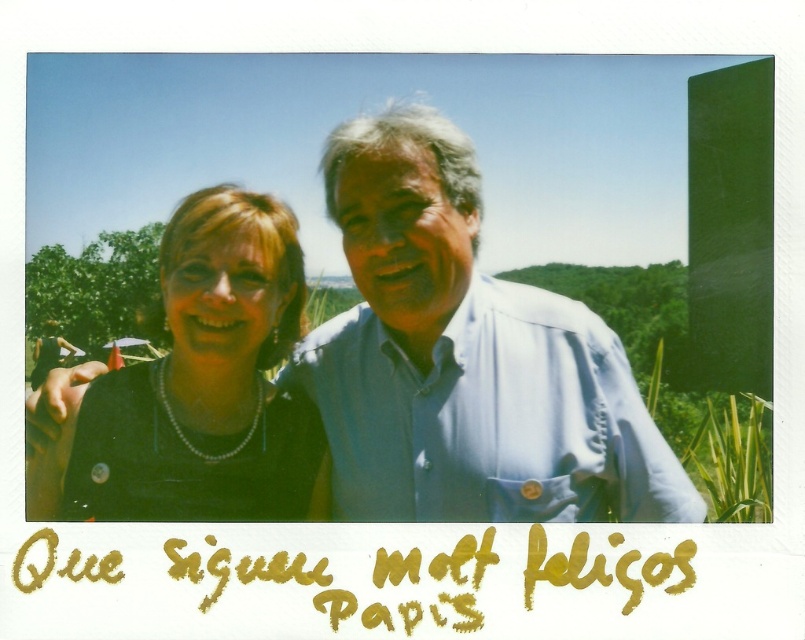
Between point (428, 372) and point (208, 474), which one is positioned behind?

The point (208, 474) is more distant.

Which of these two, black matte shirt at center or pearl necklace at center, stands taller?

black matte shirt at center is taller.

Image resolution: width=805 pixels, height=640 pixels. What are the coordinates of `black matte shirt at center` in the screenshot? It's located at (465, 358).

Where is `black matte shirt at center`? The image size is (805, 640). black matte shirt at center is located at coordinates (465, 358).